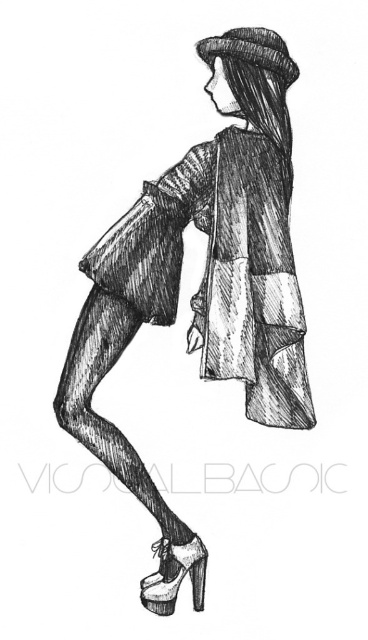
You are a fashion designer assessing the proportions of the outfit. Given that the matte black coat at center and the dark brown textured hat at upper center are key elements, which one occupies more vertical space in the composition?

The matte black coat at center has a greater height compared to the dark brown textured hat at upper center, so it occupies more vertical space in the composition.